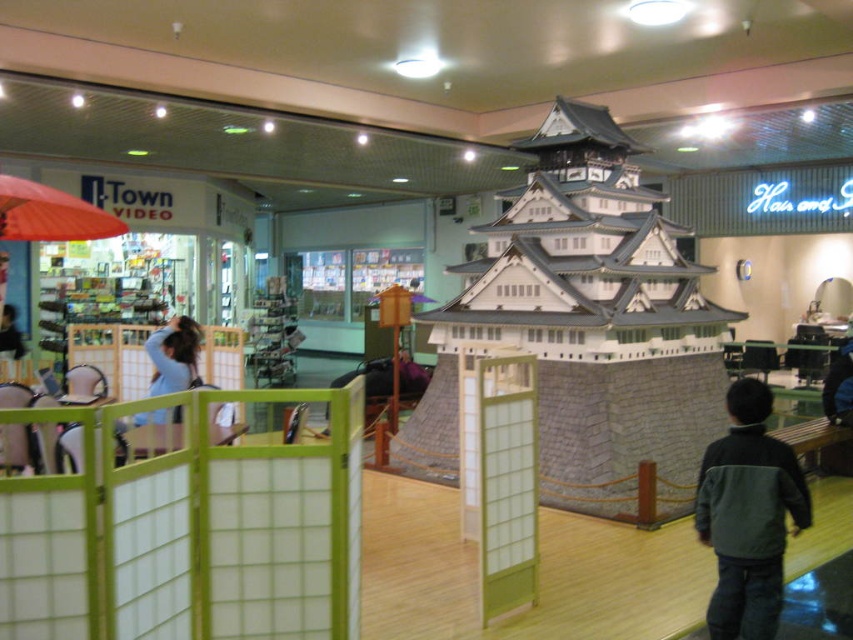
Is dark green fleece jacket at lower right closer to the viewer compared to orange fabric umbrella at upper left?

Yes, dark green fleece jacket at lower right is in front of orange fabric umbrella at upper left.

Based on the photo, who is positioned more to the left, dark green fleece jacket at lower right or orange fabric umbrella at upper left?

orange fabric umbrella at upper left is more to the left.

Who is more distant from viewer, (732, 493) or (33, 205)?

Point (33, 205)

Locate an element on the screen. The height and width of the screenshot is (640, 853). dark green fleece jacket at lower right is located at coordinates (747, 515).

Can you confirm if orange fabric umbrella at upper left is thinner than light blue fabric at left?

Incorrect, orange fabric umbrella at upper left's width is not less than light blue fabric at left's.

Is orange fabric umbrella at upper left closer to camera compared to light blue fabric at left?

That is True.

Is point (9, 179) positioned before point (169, 348)?

Yes, it is in front of point (169, 348).

Locate an element on the screen. orange fabric umbrella at upper left is located at coordinates (50, 212).

Does dark green fleece jacket at lower right come behind light blue fabric at left?

No, it is not.

Who is more distant from viewer, (735, 410) or (190, 340)?

The point (190, 340) is behind.

At what (x,y) coordinates should I click in order to perform the action: click on dark green fleece jacket at lower right. Please return your answer as a coordinate pair (x, y). This screenshot has height=640, width=853. Looking at the image, I should click on (747, 515).